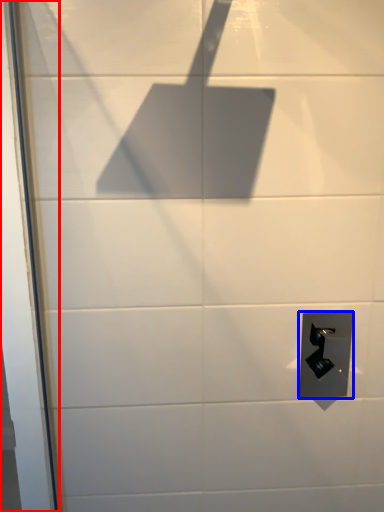
Question: Which of the following is the farthest to the observer, screen door (highlighted by a red box) or door handle (highlighted by a blue box)?

Choices:
 (A) screen door
 (B) door handle

Answer: (B)